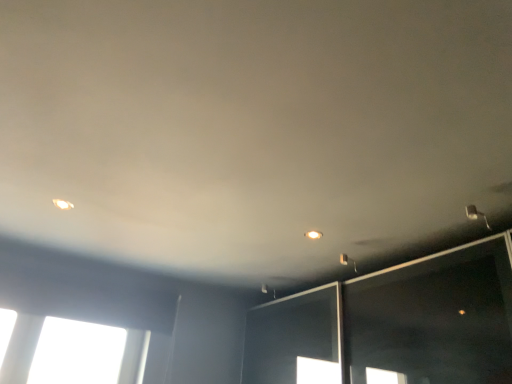
Question: Is matte white light fixture at upper right, which is counted as the second dot, starting from the front, bigger than matte white light fixture at upper right?

Choices:
 (A) yes
 (B) no

Answer: (B)

Question: Would you say matte white light fixture at upper right is part of matte white light fixture at upper right, which is counted as the second dot, starting from the front,'s contents?

Choices:
 (A) no
 (B) yes

Answer: (A)

Question: Does matte white light fixture at upper right, the 1th dot from the right, have a greater height compared to matte white light fixture at upper right?

Choices:
 (A) yes
 (B) no

Answer: (B)

Question: Is matte white light fixture at upper right, which is counted as the second dot, starting from the front, positioned beyond the bounds of matte white light fixture at upper right?

Choices:
 (A) yes
 (B) no

Answer: (A)

Question: Is matte white light fixture at upper right, the 1th dot from the right, wider than matte white light fixture at upper right?

Choices:
 (A) no
 (B) yes

Answer: (A)

Question: Does matte white light fixture at upper right, which appears as the 1th dot when ordered from the bottom, have a lesser width compared to matte white light fixture at upper right?

Choices:
 (A) yes
 (B) no

Answer: (A)

Question: Is the depth of matte white light fixture at upper left, the 2th dot in the right-to-left sequence, less than that of matte white light fixture at upper right, the 2th dot viewed from the left?

Choices:
 (A) yes
 (B) no

Answer: (A)

Question: Considering the relative sizes of matte white light fixture at upper left, acting as the 1th dot starting from the top, and matte white light fixture at upper right, the 1th dot from the right, in the image provided, is matte white light fixture at upper left, acting as the 1th dot starting from the top, bigger than matte white light fixture at upper right, the 1th dot from the right,?

Choices:
 (A) yes
 (B) no

Answer: (B)

Question: Is the depth of matte white light fixture at upper left, which is the first dot from front to back, greater than that of matte white light fixture at upper right, the 1th dot from the right?

Choices:
 (A) yes
 (B) no

Answer: (B)

Question: Is matte white light fixture at upper left, marked as the second dot in a bottom-to-top arrangement, at the right side of matte white light fixture at upper right, which is counted as the second dot, starting from the front?

Choices:
 (A) yes
 (B) no

Answer: (B)

Question: Is matte white light fixture at upper right, which is counted as the second dot, starting from the front, completely or partially inside matte white light fixture at upper left, acting as the 1th dot starting from the top?

Choices:
 (A) no
 (B) yes

Answer: (A)

Question: Can you confirm if matte white light fixture at upper left, marked as the second dot in a bottom-to-top arrangement, is taller than matte white light fixture at upper right, the 1th dot positioned from the back?

Choices:
 (A) yes
 (B) no

Answer: (B)

Question: Is matte white light fixture at upper right, which appears as the 1th dot when ordered from the bottom, a part of matte white light fixture at upper right?

Choices:
 (A) no
 (B) yes

Answer: (A)